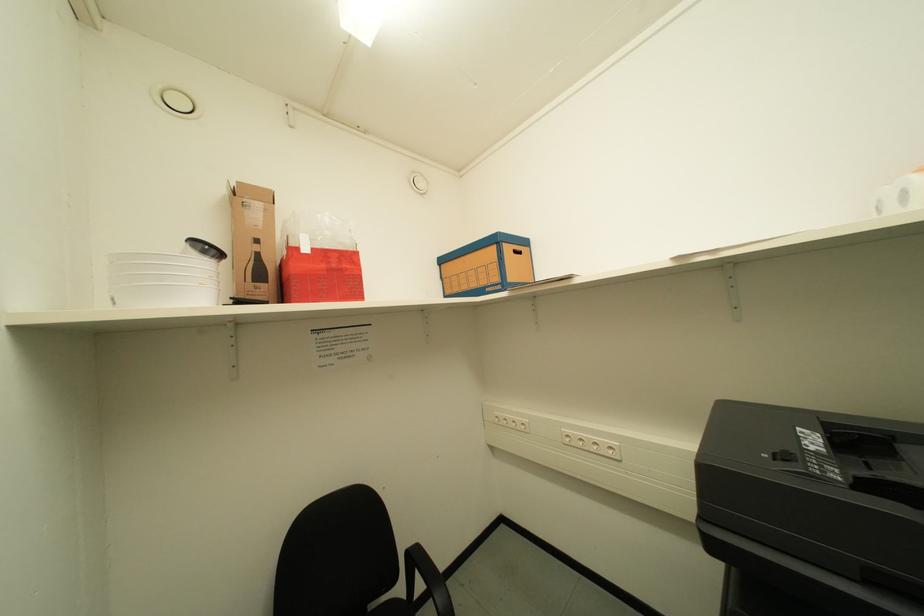
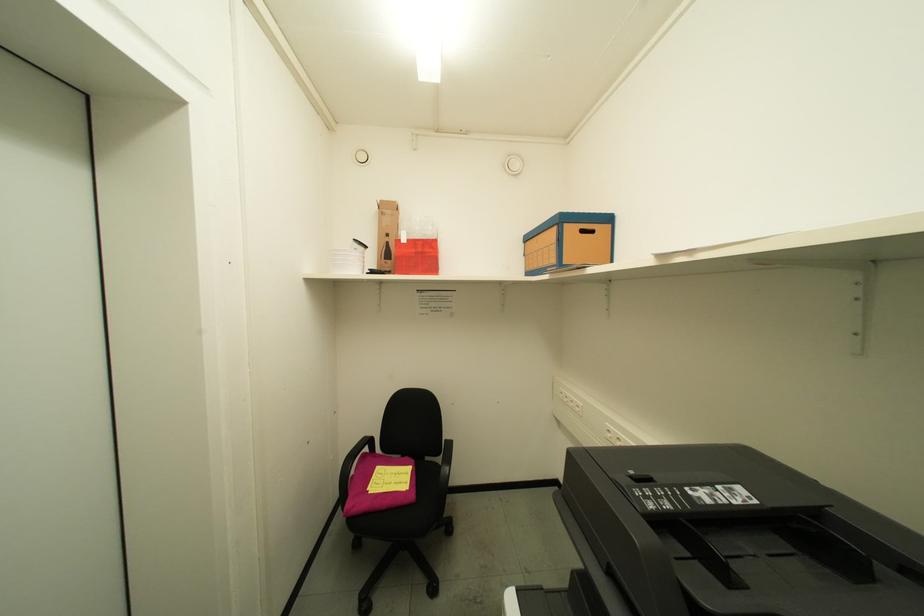
Question: The camera is either moving clockwise (left) or counter-clockwise (right) around the object. The first image is from the beginning of the video and the second image is from the end. Is the camera moving left or right when shooting the video?

Choices:
 (A) Left
 (B) Right

Answer: (B)